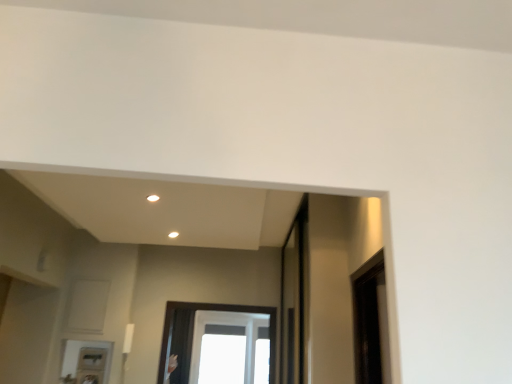
At what (x,y) coordinates should I click in order to perform the action: click on black fabric curtain at lower center. Please return your answer as a coordinate pair (x, y). The height and width of the screenshot is (384, 512). Looking at the image, I should click on tap(181, 344).

What is the approximate width of black fabric curtain at lower center?

black fabric curtain at lower center is 3.90 inches in width.

This screenshot has width=512, height=384. What do you see at coordinates (181, 344) in the screenshot?
I see `black fabric curtain at lower center` at bounding box center [181, 344].

Locate an element on the screen. This screenshot has width=512, height=384. black fabric curtain at lower center is located at coordinates (181, 344).